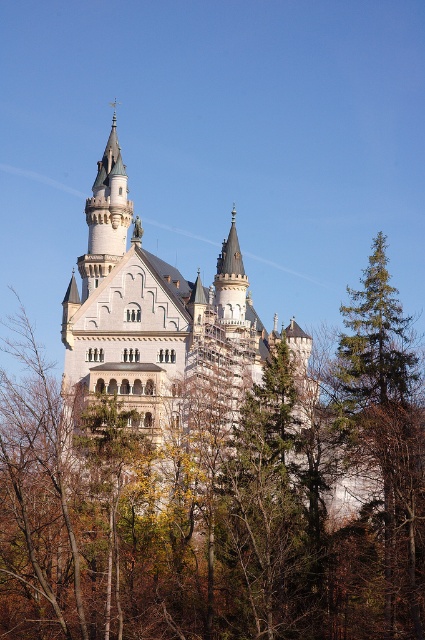
Question: Does white stone castle at center appear on the right side of white stone tower at upper center?

Choices:
 (A) yes
 (B) no

Answer: (A)

Question: Can you confirm if white stone castle at center is smaller than white stone tower at upper center?

Choices:
 (A) yes
 (B) no

Answer: (B)

Question: Can you confirm if white stone castle at center is positioned to the right of white stone tower at upper center?

Choices:
 (A) yes
 (B) no

Answer: (A)

Question: Which of the following is the closest to the observer?

Choices:
 (A) (255, 333)
 (B) (130, 211)

Answer: (A)